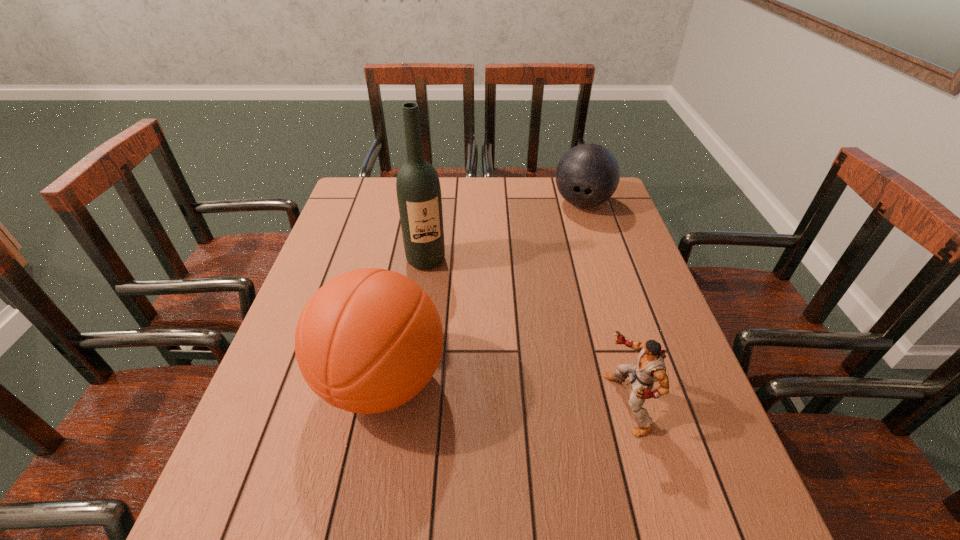
You are a GUI agent. You are given a task and a screenshot of the screen. Output one action in this format:
    pyautogui.click(x=<x>, y=<y>)
    Task: Click on the free space between the bowling ball and the puncher
    This screenshot has width=960, height=540.
    Given the screenshot: What is the action you would take?
    (604, 303)

I want to click on unoccupied position between the tallest object and the puncher, so 526,332.

The height and width of the screenshot is (540, 960). I want to click on free spot between the puncher and the second tallest object, so click(x=504, y=393).

Identify the location of free spot between the second farthest object and the farthest object. The height and width of the screenshot is (540, 960). (504, 231).

The image size is (960, 540). Find the location of `empty space between the wine bottle and the puncher`. empty space between the wine bottle and the puncher is located at coordinates (526, 332).

Find the location of `vacant point located between the basketball and the farthest object`. vacant point located between the basketball and the farthest object is located at coordinates (482, 292).

The height and width of the screenshot is (540, 960). In order to click on empty space between the basketball and the puncher in this screenshot , I will do `click(504, 393)`.

Find the location of a particular element. empty space between the bowling ball and the puncher is located at coordinates click(x=604, y=303).

The image size is (960, 540). I want to click on free spot between the basketball and the bowling ball, so click(x=482, y=292).

Choose which object is the nearest neighbor to the second tallest object. Please provide its 2D coordinates. Your answer should be formatted as a tuple, i.e. [(x, y)], where the tuple contains the x and y coordinates of a point satisfying the conditions above.

[(418, 189)]